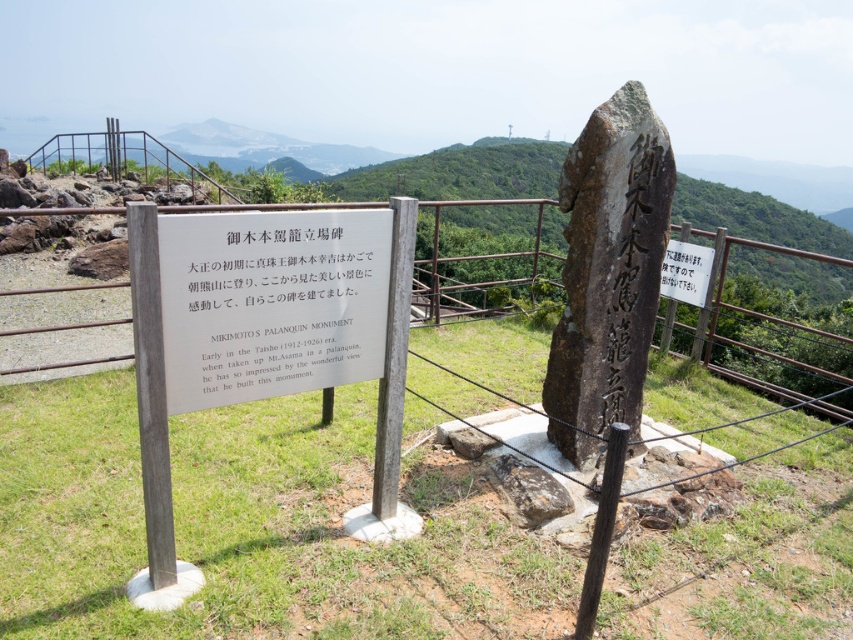
Which of these two, metallic silver fence at upper center or white paper sign at upper center, stands shorter?

With less height is white paper sign at upper center.

Is point (770, 392) behind point (677, 289)?

No.

The width and height of the screenshot is (853, 640). I want to click on metallic silver fence at upper center, so click(x=483, y=204).

Does white paper sign at center have a greater height compared to metallic silver fence at upper center?

Incorrect, white paper sign at center's height is not larger of metallic silver fence at upper center's.

What do you see at coordinates (326, 349) in the screenshot? I see `white paper sign at center` at bounding box center [326, 349].

You are a GUI agent. You are given a task and a screenshot of the screen. Output one action in this format:
    pyautogui.click(x=<x>, y=<y>)
    Task: Click on the white paper sign at center
    The height and width of the screenshot is (640, 853).
    Given the screenshot: What is the action you would take?
    pyautogui.click(x=326, y=349)

Who is lower down, white paper at center or white paper sign at upper center?

white paper at center is lower down.

Between white paper at center and white paper sign at upper center, which one has less height?

white paper sign at upper center

Where is `white paper at center`? white paper at center is located at coordinates click(x=271, y=301).